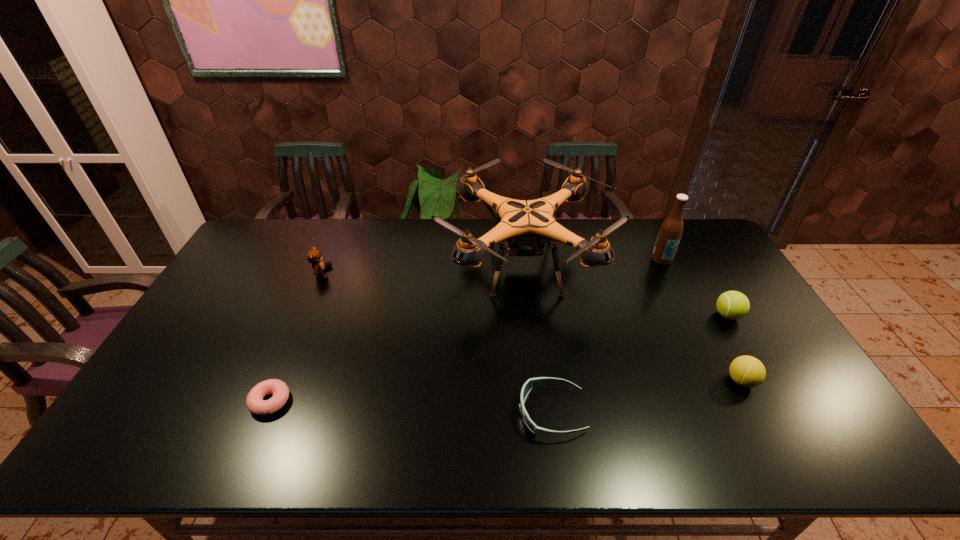
Find the location of a particular element. Image resolution: width=960 pixels, height=540 pixels. drone is located at coordinates [522, 227].

This screenshot has width=960, height=540. In order to click on beer bottle in this screenshot , I will do `click(671, 230)`.

At what (x,y) coordinates should I click in order to perform the action: click on teddy bear. Please return your answer as a coordinate pair (x, y). The height and width of the screenshot is (540, 960). Looking at the image, I should click on (314, 256).

In order to click on the farther tennis ball in this screenshot , I will do `click(733, 305)`.

The width and height of the screenshot is (960, 540). I want to click on the nearer tennis ball, so click(x=747, y=371).

The width and height of the screenshot is (960, 540). I want to click on goggles, so click(527, 387).

You are a GUI agent. You are given a task and a screenshot of the screen. Output one action in this format:
    pyautogui.click(x=<x>, y=<y>)
    Task: Click on the shortest object
    
    Given the screenshot: What is the action you would take?
    pyautogui.click(x=255, y=403)

Identify the location of vacant space situated on the camera mount of the drone. This screenshot has width=960, height=540. (366, 266).

Image resolution: width=960 pixels, height=540 pixels. I want to click on vacant space situated on the camera mount of the drone, so click(x=346, y=266).

Where is `vacant point located on the camera mount of the drone`? This screenshot has height=540, width=960. vacant point located on the camera mount of the drone is located at coordinates (363, 266).